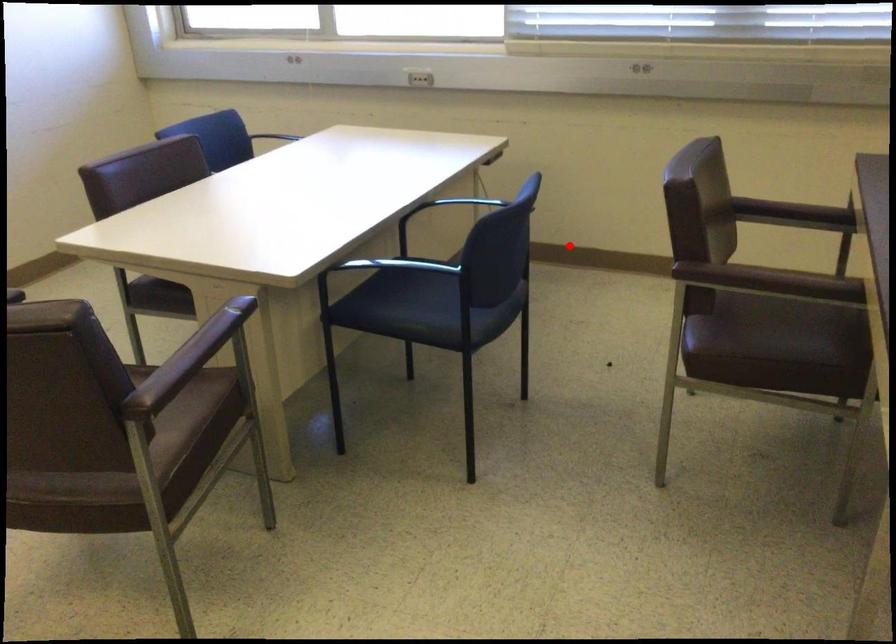
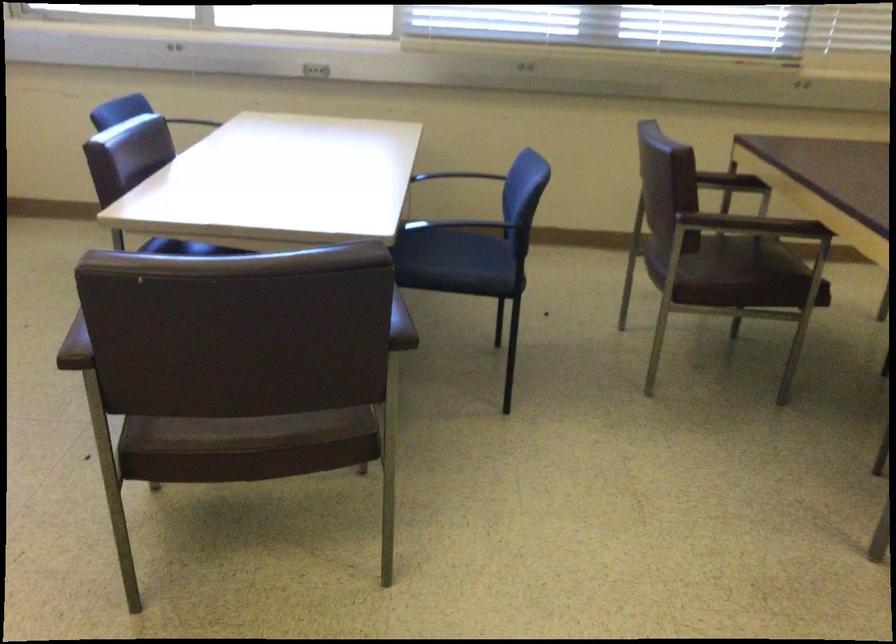
Question: I am providing you with two images of the same scene from different viewpoints. In image1, a red point is highlighted. Considering the same 3D point in image2, which of the following is correct?

Choices:
 (A) It is closer
 (B) It is farther

Answer: (B)